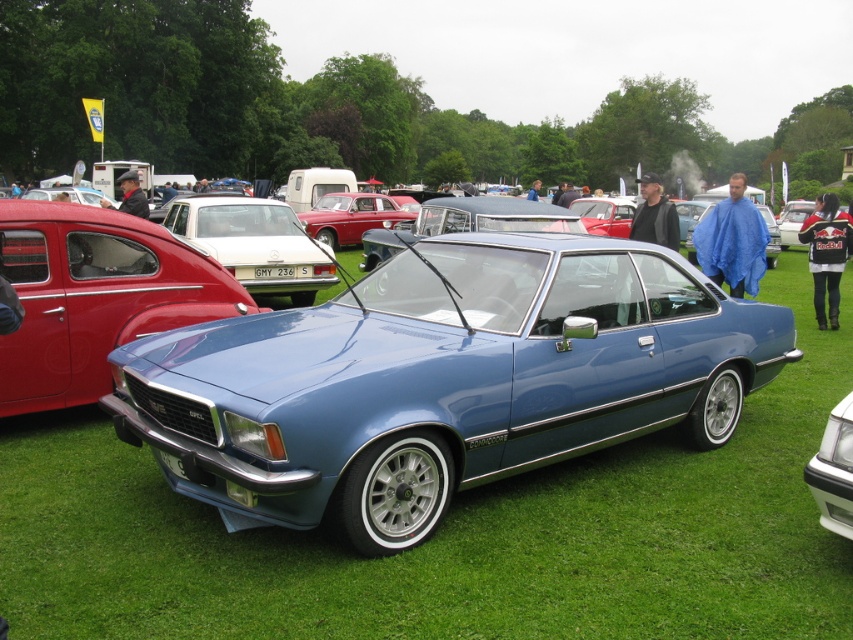
You are a photographer setting up a wide shot of the car show. You need to frame the matte red sedan at left and the metallic silver coupe at center so that both are fully visible. Given their widths, which car should be placed closer to the edge of the frame to prevent cropping?

The matte red sedan at left has a lesser width compared to the metallic silver coupe at center, so placing the narrower matte red sedan at left closer to the edge of the frame would prevent cropping since it requires less space horizontally.

You are standing at the origin point in the car show field. You see two points marked in the image, point 1 at coordinates point (33, 218) and point 2 at coordinates point (844, 493). Which point is closer to you?

Point (33, 218) is behind point (844, 493), so point (844, 493) is closer to you.